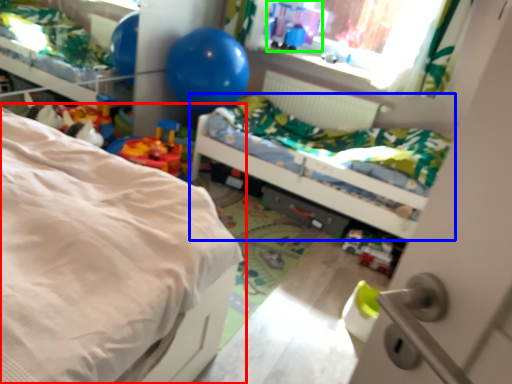
Question: Which is farther away from bed (highlighted by a red box)? bed (highlighted by a blue box) or toy (highlighted by a green box)?

Choices:
 (A) bed
 (B) toy

Answer: (B)